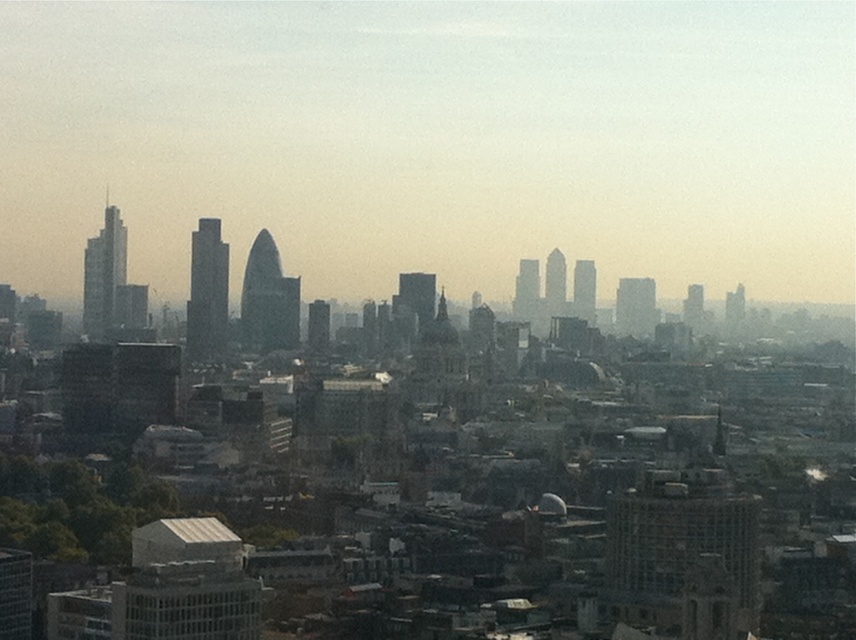
You are a city planner analyzing the skyline. You need to determine which of the two skyscrapers at the center is taller. The options are the matte glass skyscrapers at center and the glassy gray skyscraper at center. Which one is taller?

The matte glass skyscrapers at center is taller than the glassy gray skyscraper at center according to the description.

In the scene shown: You are a city planner reviewing the cityscape. You notice the matte glass skyscrapers at center and the glassy gray skyscraper at center. Which one is positioned to the right of the other?

The matte glass skyscrapers at center is to the right of glassy gray skyscraper at center according to the description.